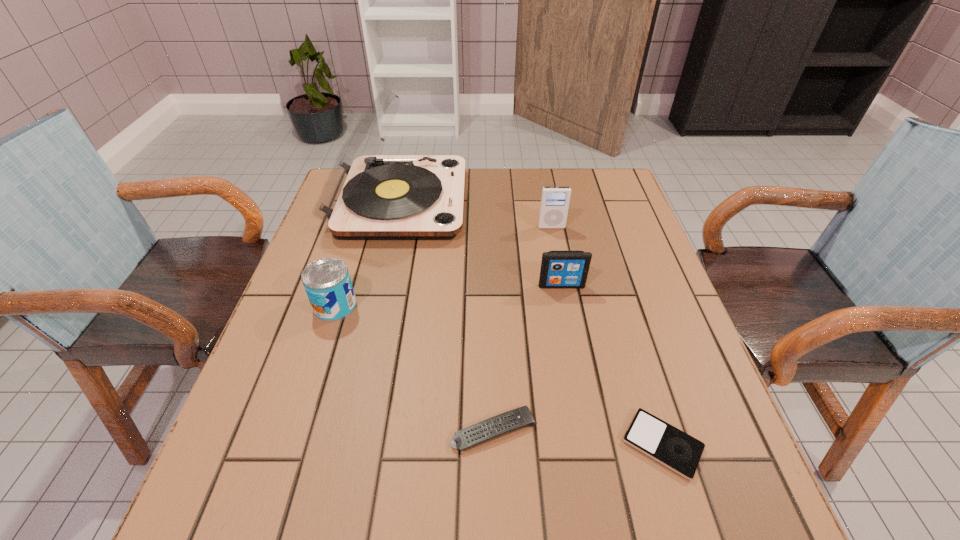
Find the location of `object that is positioned at the far left corner`. object that is positioned at the far left corner is located at coordinates (366, 196).

This screenshot has width=960, height=540. I want to click on object at the near right corner, so click(678, 451).

In the image, there is a desktop. Where is `vacant space at the far edge`? This screenshot has height=540, width=960. vacant space at the far edge is located at coordinates (487, 210).

At what (x,y) coordinates should I click in order to perform the action: click on free space at the near edge of the desktop. Please return your answer as a coordinate pair (x, y). Looking at the image, I should click on (456, 503).

Locate an element on the screen. free space at the left edge of the desktop is located at coordinates (371, 249).

Find the location of a particular element. The width and height of the screenshot is (960, 540). free region at the right edge is located at coordinates (660, 302).

I want to click on blank space at the far right corner of the desktop, so click(627, 211).

I want to click on free space between the shortest object and the third farthest object, so click(x=612, y=365).

Identify the location of vacant area between the fifth tallest object and the farthest iPod. (522, 329).

Identify the location of vacant space that is in between the second shortest iPod and the remote control. The height and width of the screenshot is (540, 960). (528, 357).